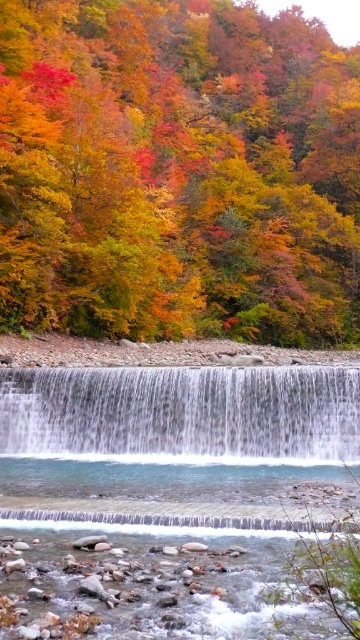
You are standing at the base of the waterfall in the autumnal landscape. There is a point marked at coordinates [177,172]. What can you see at that point?

At the coordinates [177,172], you can see multicolored autumn leaves at upper center.

You are a photographer standing at the edge of the rocky riverbed. You want to capture a photo that includes both the multicolored autumn leaves at upper center and the clear glass waterfall at center. Which object should you position closer to the left side of your camera frame?

→ You should position the clear glass waterfall at center closer to the left side of your camera frame because the multicolored autumn leaves at upper center is to the right of it.

You are standing at the base of the waterfall in the autumnal landscape. You notice a point marked at coordinates (177,172). What is located at this point?

The point at coordinates (177,172) corresponds to multicolored autumn leaves at upper center.